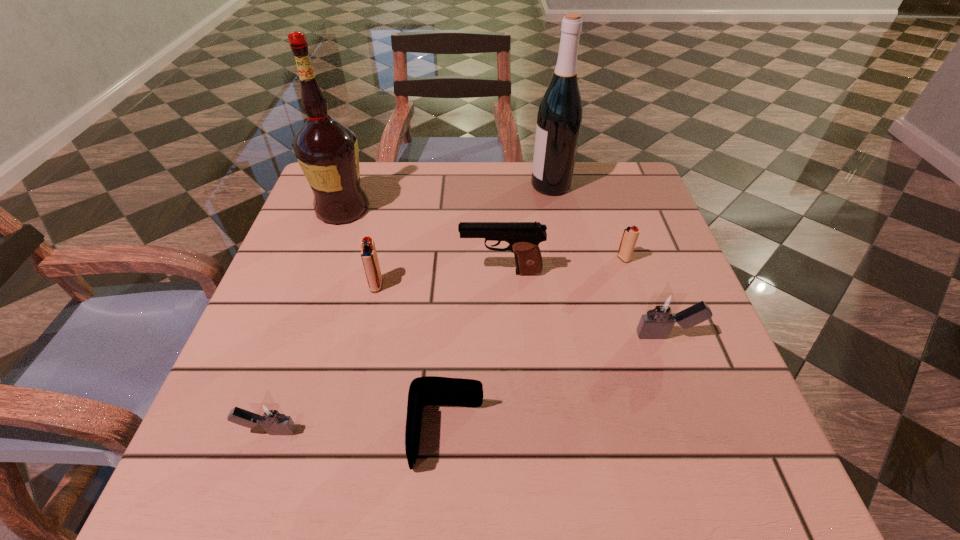
Image resolution: width=960 pixels, height=540 pixels. In order to click on the second closest igniter to the alcohol in this screenshot , I will do `click(269, 414)`.

What are the coordinates of `igniter that stands as the second closest to the sixth object from right to left` in the screenshot? It's located at (662, 312).

The width and height of the screenshot is (960, 540). What are the coordinates of `blank area in the image that satisfies the following two spatial constraints: 1. on the label of the brown alcohol; 2. on the left side of the fifth farthest object` in the screenshot? It's located at (316, 285).

Locate an element on the screen. This screenshot has width=960, height=540. vacant area in the image that satisfies the following two spatial constraints: 1. on the label of the wine bottle; 2. on the outer surface of the wallet is located at coordinates (599, 436).